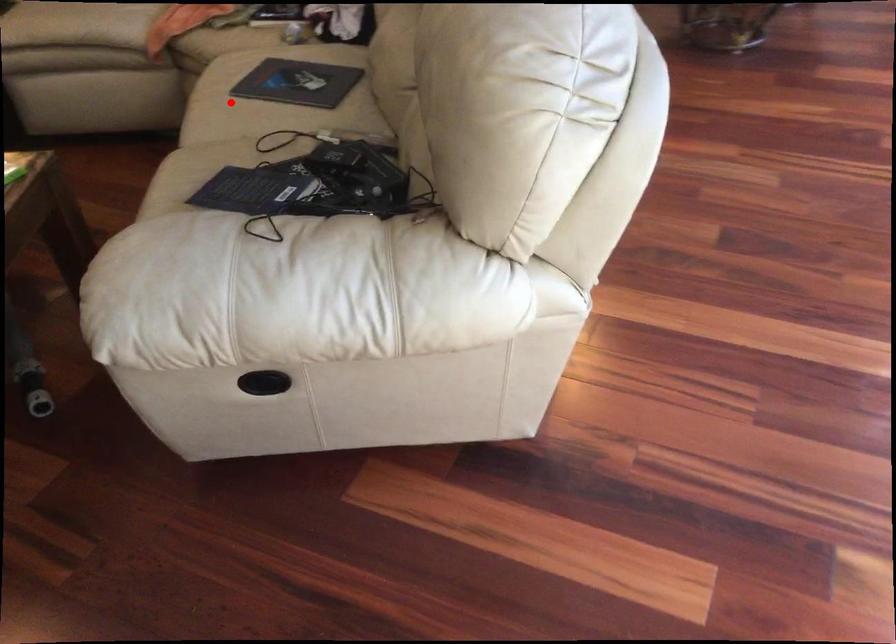
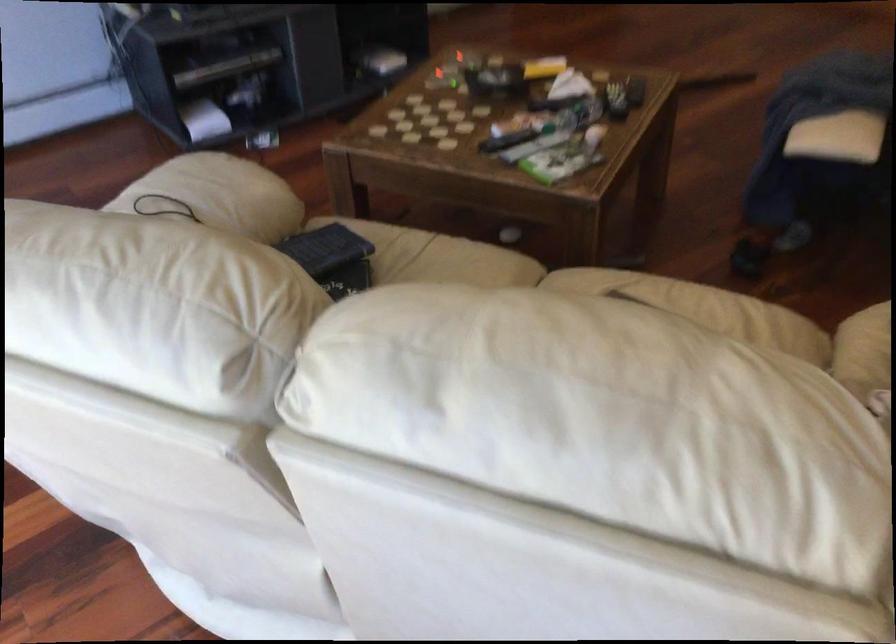
Question: I am providing you with two images of the same scene from different viewpoints. Given a red point in image1, look at the same physical point in image2. Is it:

Choices:
 (A) Closer to the viewpoint
 (B) Farther from the viewpoint

Answer: (A)